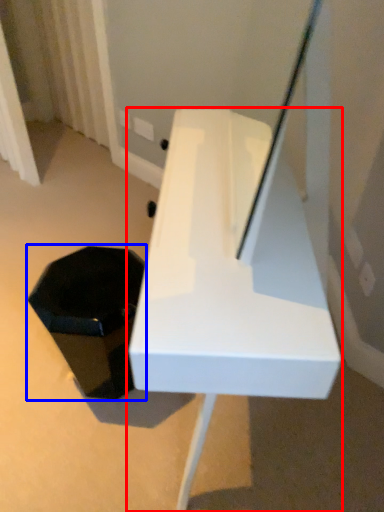
Question: Which point is further to the camera, furniture (highlighted by a red box) or storage box (highlighted by a blue box)?

Choices:
 (A) furniture
 (B) storage box

Answer: (B)